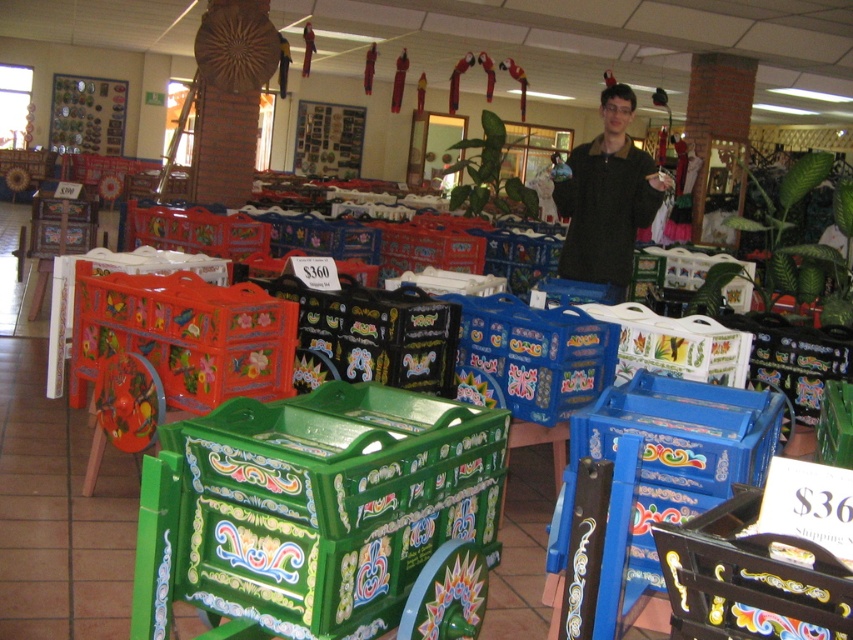
You are a customer in the shop and want to pick up the dark green textured shirt at center. You are currently holding the painted wood crate at center. Can you reach the shirt without letting go of the crate?

The painted wood crate at center and dark green textured shirt at center are 11.87 feet apart from each other, so you would need to let go of the crate to reach the shirt as they are too far apart to hold both simultaneously.

You are a delivery person who needs to place a new box between the green plastic crate at center and the painted wood crate at center. The new box is 30 inches long. Will there be enough space to fit it between them?

The distance between the green plastic crate at center and the painted wood crate at center is 34.73 inches. Since the new box is 30 inches long, it will fit as there is enough space between them.

You are a customer in the shop and want to see the dark green textured shirt at center. However, the green plastic crate at center is blocking your view. Can you move the crate to get a better look at the shirt?

The green plastic crate at center is in front of the dark green textured shirt at center, so moving the crate would allow you to see the shirt clearly.